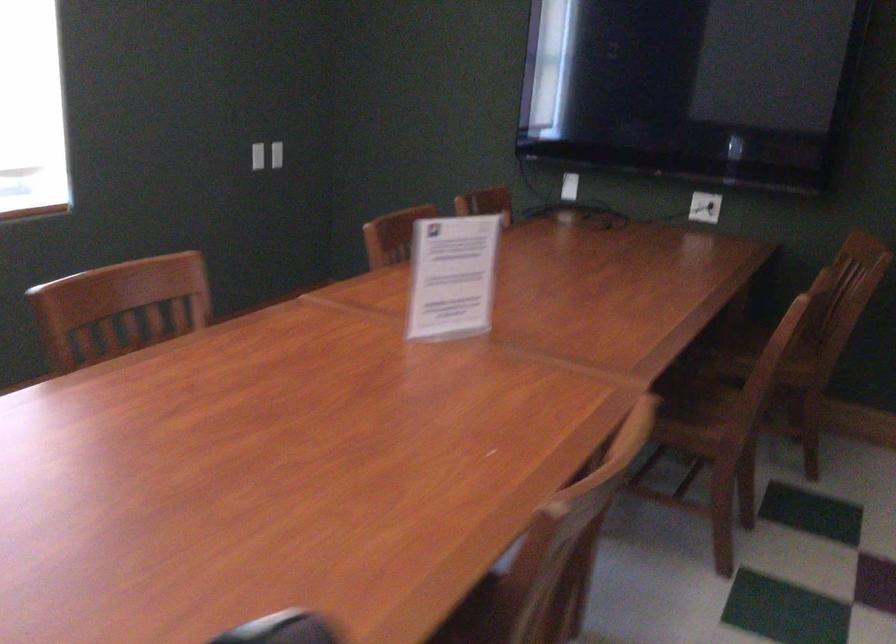
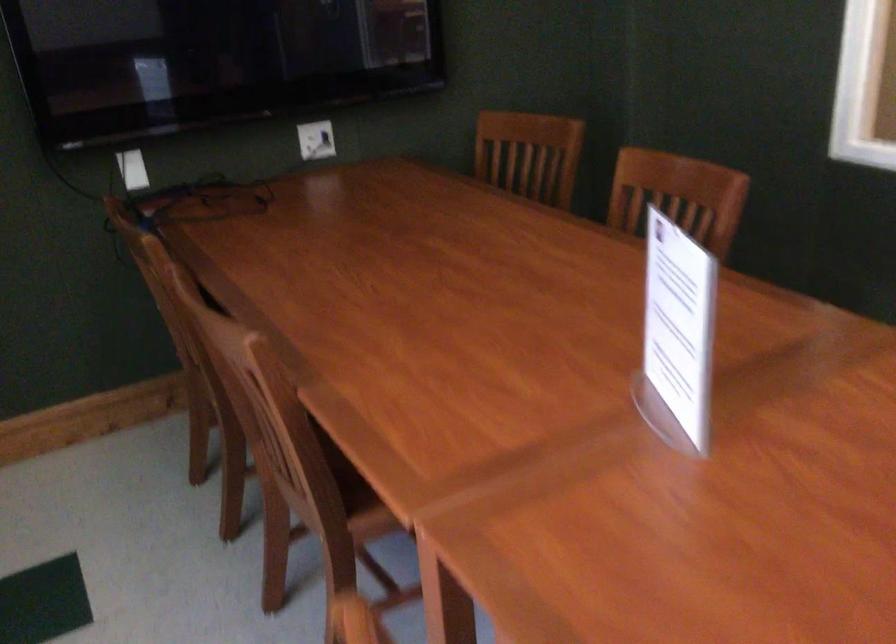
Find the pixel in the second image that matches pixel 800 310 in the first image.

(677, 196)